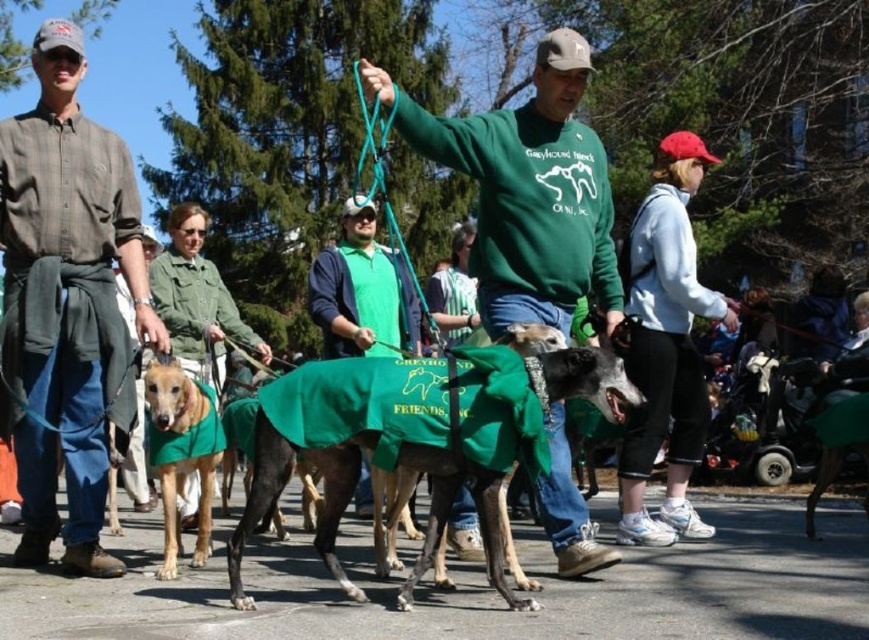
You are organizing a costume party and need to decide which outfit to wear. You have the plaid shirt at left and the white fleece jacket at upper right. Which one is more suitable for a cold evening?

The white fleece jacket at upper right is more suitable for a cold evening since it is thicker than the plaid shirt at left.

You are a photographer standing at the edge of the scene. You need to capture a photo that includes both the green fleece vest at center and the golden fur coat at center. What is the minimum focal length lens you should use if your camera sensor has a diagonal of 24mm and you want the entire scene to fit within the frame?

The minimum focal length lens required is approximately 24mm multiplied by the distance to the subjects divided by the sensor diagonal. However, since the distance between the two objects is 2.99 meters, the exact calculation requires knowing the distance from the camera to the subjects. Without that information, we can only state that the objects are 2.99 meters apart.

You are organizing a charity walk and need to ensure participants can see the event logo clearly. Which clothing item, the green fleece sweatshirt at center or the green fabric jacket at center, should participants wear to display the logo more prominently?

The green fabric jacket at center should be worn to display the logo more prominently because it is taller than the green fleece sweatshirt at center, making the logo more visible.